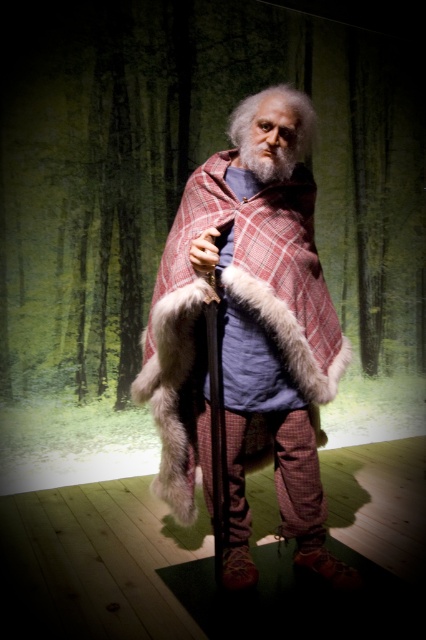
You are a medieval tailor observing the figure in the scene. You need to adjust the plaid wool cape at center and the graywoollybeard at center. Which item is located lower on the figure?

The plaid wool cape at center is positioned under the graywoollybeard at center, so the plaid wool cape at center is lower on the figure.

Based on the scene description, can you determine if the plaid wool cape at center is wider than the graywoollybeard at center?

The plaid wool cape at center is wider than the graywoollybeard at center according to the description.